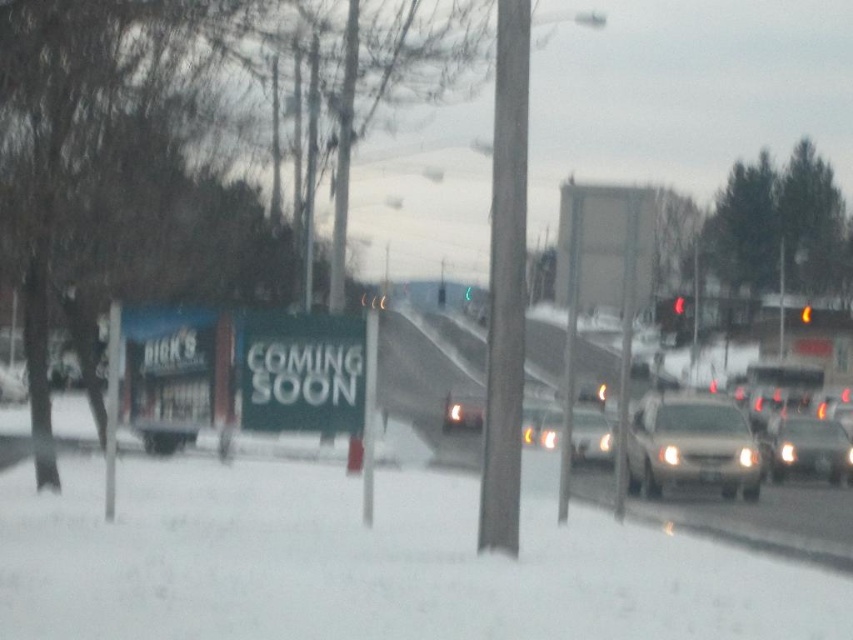
Is white plastic sign at center smaller than matte silver sedan at right?

Indeed, white plastic sign at center has a smaller size compared to matte silver sedan at right.

Does point (283, 340) come closer to viewer compared to point (779, 420)?

Yes, it is in front of point (779, 420).

Identify the location of white plastic sign at center. Image resolution: width=853 pixels, height=640 pixels. (300, 372).

Can you confirm if satin gold sedan at center is taller than red glass traffic light at upper center?

No.

Does satin gold sedan at center have a lesser width compared to red glass traffic light at upper center?

Correct, satin gold sedan at center's width is less than red glass traffic light at upper center's.

Where is `satin gold sedan at center`? This screenshot has height=640, width=853. satin gold sedan at center is located at coordinates [x=691, y=445].

Is red glass traffic light at upper center bigger than red glass traffic light at upper right?

Correct, red glass traffic light at upper center is larger in size than red glass traffic light at upper right.

Locate an element on the screen. red glass traffic light at upper center is located at coordinates (677, 305).